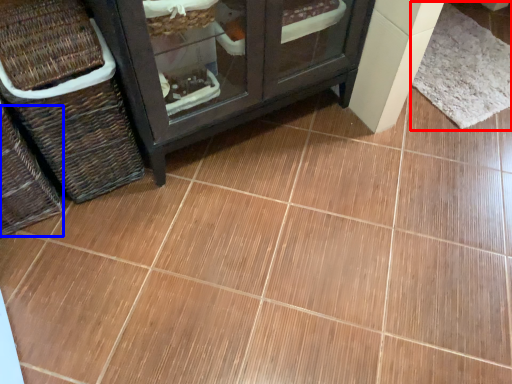
Question: Among these objects, which one is farthest to the camera, mat (highlighted by a red box) or basket (highlighted by a blue box)?

Choices:
 (A) mat
 (B) basket

Answer: (A)